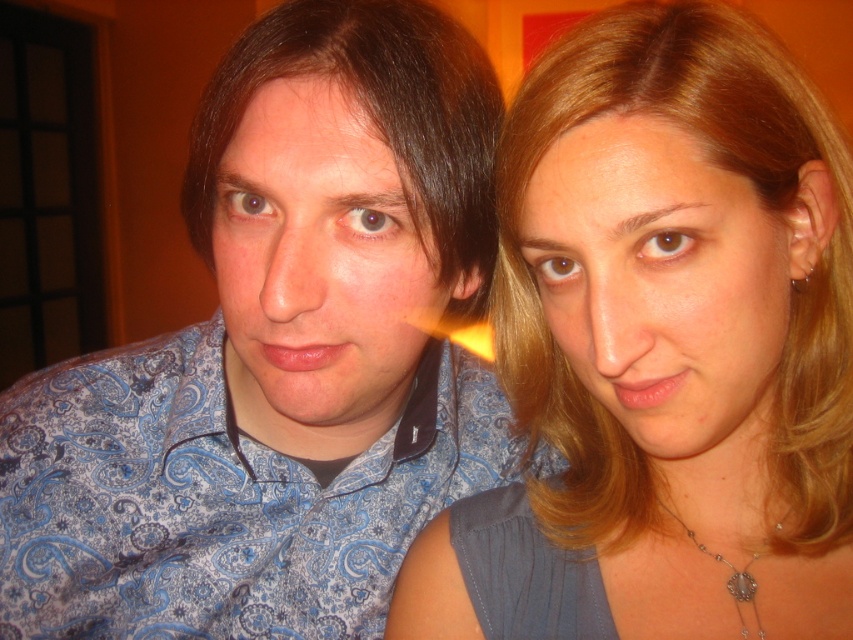
You are a photographer trying to capture a portrait of both individuals. You need to adjust your camera to focus on the smooth blonde hair at center and the blonde hair at right. Based on their positions, which hair should you focus on first to ensure proper depth of field?

The smooth blonde hair at center is located below the blonde hair at right. Since the smooth blonde hair at center is closer to the camera, you should focus on it first to ensure proper depth of field.